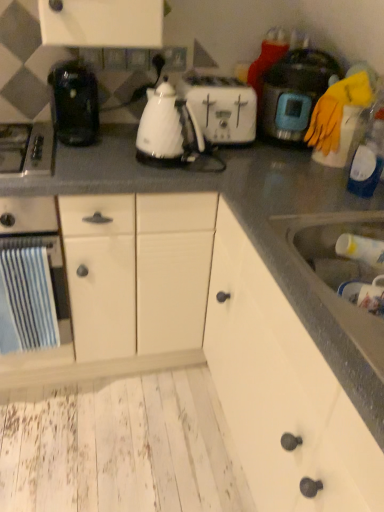
In order to click on blank area beneath white glossy electric kettle at center, positioned as the second kitchen appliance in right-to-left order (from a real-world perspective) in this screenshot , I will do `click(158, 160)`.